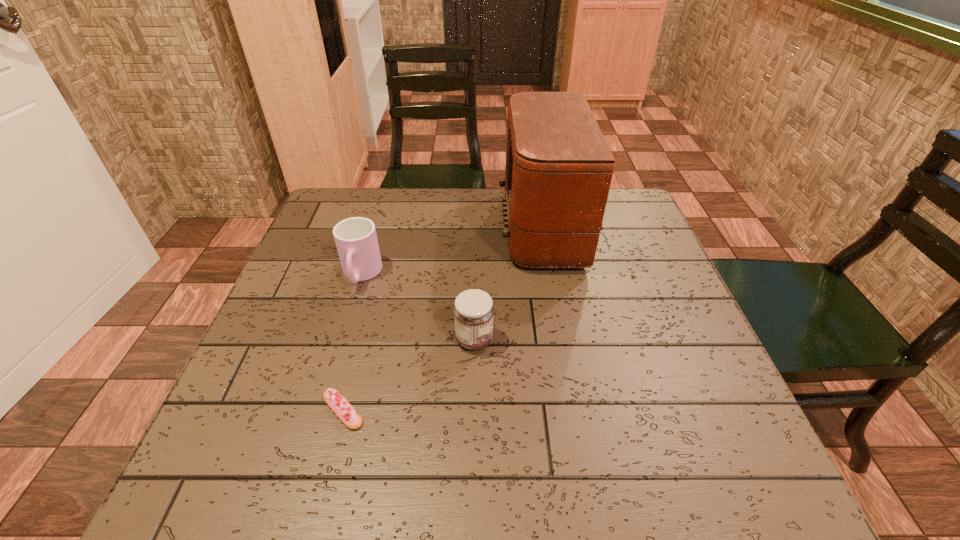
This screenshot has width=960, height=540. I want to click on free space between the cup and the nearest object, so click(352, 342).

Where is `vacant space that's between the radio receiver and the nearest object`? vacant space that's between the radio receiver and the nearest object is located at coordinates 452,319.

The width and height of the screenshot is (960, 540). I want to click on blank region between the cup and the jam, so click(418, 307).

Where is `vacant area that lies between the cup and the radio receiver`? vacant area that lies between the cup and the radio receiver is located at coordinates (462, 252).

This screenshot has width=960, height=540. Find the location of `vacant region between the radio receiver and the jam`. vacant region between the radio receiver and the jam is located at coordinates (517, 284).

Identify the location of object that is the third closest to the tallest object. (339, 405).

Identify which object is the third nearest to the jam. Please provide its 2D coordinates. Your answer should be formatted as a tuple, i.e. [(x, y)], where the tuple contains the x and y coordinates of a point satisfying the conditions above.

[(356, 240)]

Where is `vacant area in the image that satisfies the following two spatial constraints: 1. on the front panel of the tallest object; 2. with the handle on the side of the cup`? The image size is (960, 540). vacant area in the image that satisfies the following two spatial constraints: 1. on the front panel of the tallest object; 2. with the handle on the side of the cup is located at coordinates (572, 275).

Image resolution: width=960 pixels, height=540 pixels. I want to click on free space that satisfies the following two spatial constraints: 1. with the handle on the side of the cup; 2. on the left side of the eclair, so click(321, 410).

The width and height of the screenshot is (960, 540). I want to click on blank area in the image that satisfies the following two spatial constraints: 1. with the handle on the side of the eclair; 2. on the left side of the cup, so point(321,410).